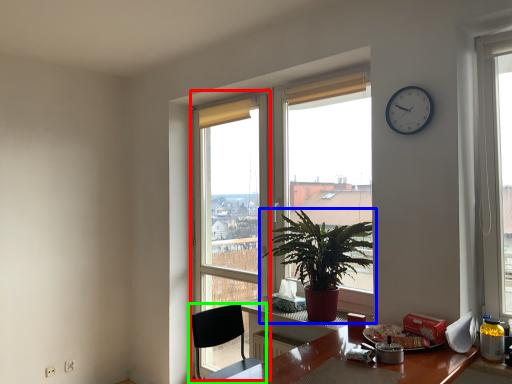
Question: Considering the real-world distances, which object is closest to glass door (highlighted by a red box)? houseplant (highlighted by a blue box) or chair (highlighted by a green box).

Choices:
 (A) houseplant
 (B) chair

Answer: (A)